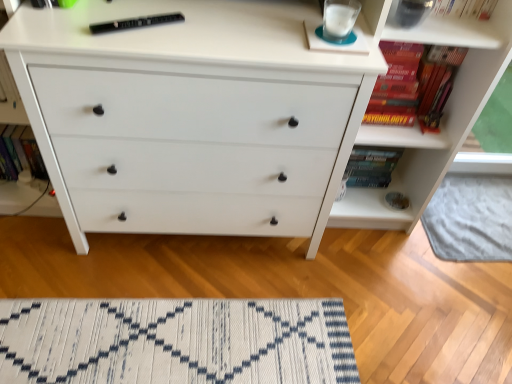
The height and width of the screenshot is (384, 512). I want to click on vacant area that lies to the right of black plastic remote at upper center, placed as the second book when sorted from left to right, so click(x=201, y=35).